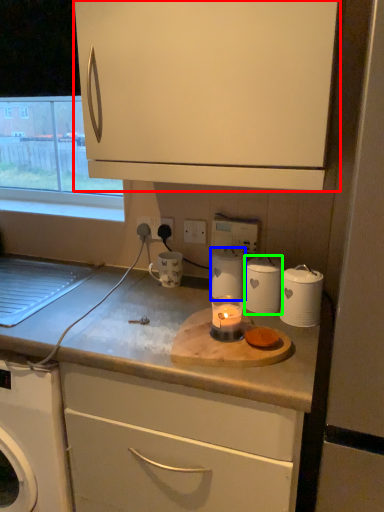
Question: Estimate the real-world distances between objects in this image. Which object is farther from cabinetry (highlighted by a red box), kitchen appliance (highlighted by a blue box) or kitchen appliance (highlighted by a green box)?

Choices:
 (A) kitchen appliance
 (B) kitchen appliance

Answer: (A)